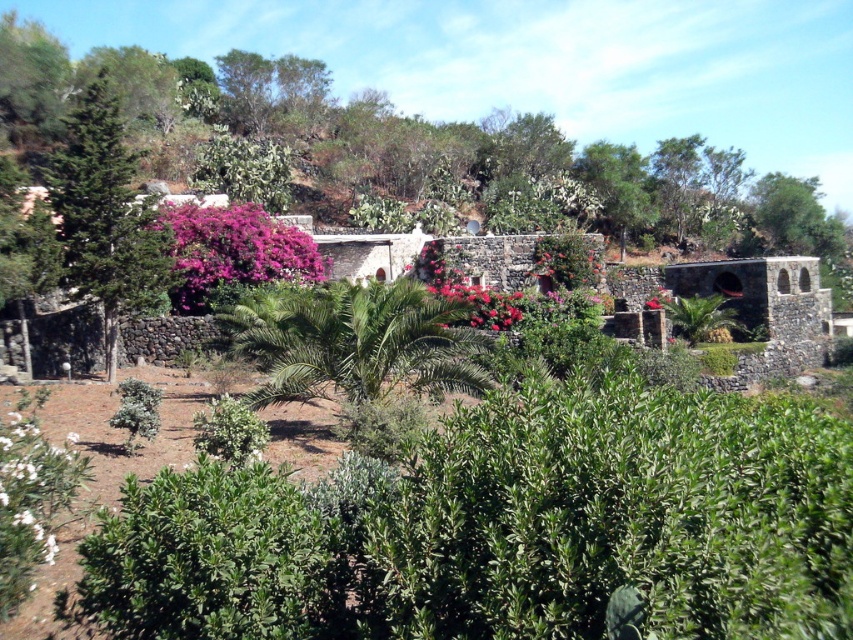
Question: Is green leafy bush at center smaller than green leafy tree at upper right?

Choices:
 (A) yes
 (B) no

Answer: (A)

Question: Which point is closer to the camera?

Choices:
 (A) green leafy bush at lower left
 (B) purple matte flowers at left

Answer: (A)

Question: Can you confirm if white matte flower at lower left is positioned to the left of green leafy bush at lower left?

Choices:
 (A) no
 (B) yes

Answer: (A)

Question: Which object is positioned closest to the purple matte flowers at left?

Choices:
 (A) green leafy bush at lower left
 (B) green leafy bush at center
 (C) white matte flower at lower left

Answer: (B)

Question: Does green textured tree at left have a smaller size compared to green leafy tree at upper right?

Choices:
 (A) yes
 (B) no

Answer: (A)

Question: Which of the following is the closest to the observer?

Choices:
 (A) green leafy bush at lower left
 (B) purple matte flowers at left

Answer: (A)